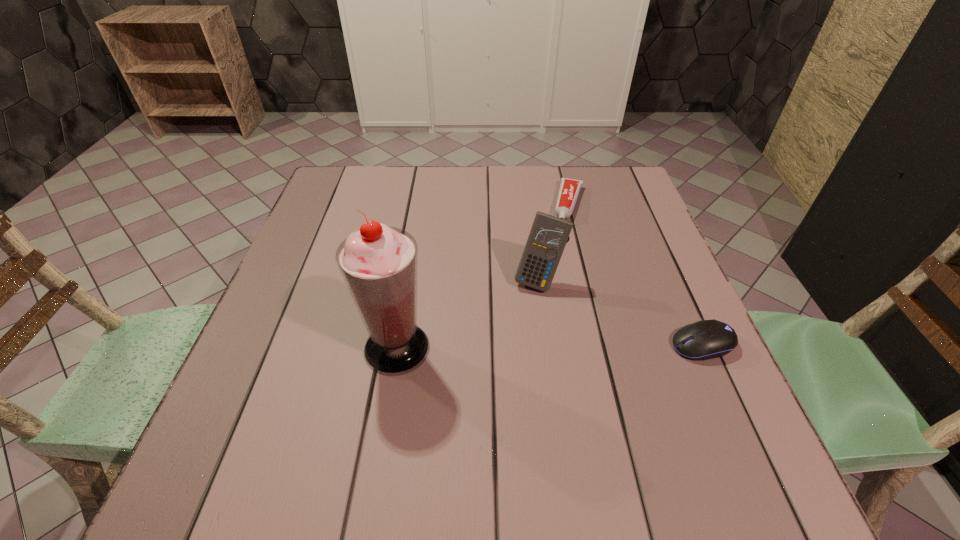
Where is `vacant region at the near edge`? Image resolution: width=960 pixels, height=540 pixels. vacant region at the near edge is located at coordinates (404, 403).

Where is `free space at the left edge of the desktop`? This screenshot has height=540, width=960. free space at the left edge of the desktop is located at coordinates (330, 339).

You are a GUI agent. You are given a task and a screenshot of the screen. Output one action in this format:
    pyautogui.click(x=<x>, y=<y>)
    Task: Click on the vacant area at the far left corner of the desktop
    
    Given the screenshot: What is the action you would take?
    pyautogui.click(x=332, y=183)

Identify the location of free space at the near left corner of the desktop. (291, 413).

Locate an element on the screen. The height and width of the screenshot is (540, 960). free location at the near right corner of the desktop is located at coordinates (691, 423).

The image size is (960, 540). In order to click on free spot between the calculator and the rightmost object in this screenshot , I will do `click(621, 312)`.

Image resolution: width=960 pixels, height=540 pixels. Identify the location of free space between the tallest object and the computer mouse. (550, 346).

Find the location of a particular element. The image size is (960, 540). empty location between the computer mouse and the smoothie is located at coordinates (550, 346).

The image size is (960, 540). What are the coordinates of `free spot between the smoothie and the third shortest object` in the screenshot? It's located at (468, 314).

Where is `unoccupied area between the leftmost object and the computer mouse`? The height and width of the screenshot is (540, 960). unoccupied area between the leftmost object and the computer mouse is located at coordinates (550, 346).